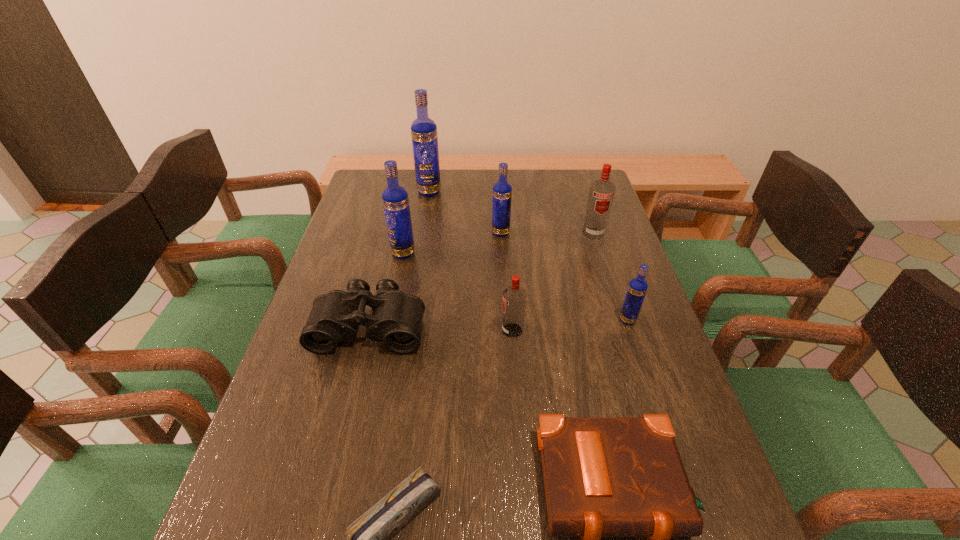
At what (x,y) coordinates should I click in order to perform the action: click on vacant space located on the front label of the nearer red vodka. Please return your answer as a coordinate pair (x, y). The height and width of the screenshot is (540, 960). Looking at the image, I should click on (394, 330).

The image size is (960, 540). In order to click on blank space located 0.060m on the front of the nearest blue vodka in this screenshot , I will do `click(636, 344)`.

Locate an element on the screen. Image resolution: width=960 pixels, height=540 pixels. free space located 0.090m at the eyepieces of the binoculars is located at coordinates (355, 387).

Identify the location of object situated at the far edge. (424, 136).

Locate an element on the screen. object at the left edge is located at coordinates (396, 320).

This screenshot has height=540, width=960. What are the coordinates of `vacant region at the far edge` in the screenshot? It's located at (458, 179).

In order to click on free region at the left edge in this screenshot , I will do `click(324, 276)`.

In the image, there is a desktop. Find the location of `vacant area at the right edge`. vacant area at the right edge is located at coordinates (633, 276).

What are the coordinates of `vacant space at the far left corner of the desktop` in the screenshot? It's located at (372, 171).

Identify the location of vacant area between the fourth farthest object and the farther red vodka. (498, 243).